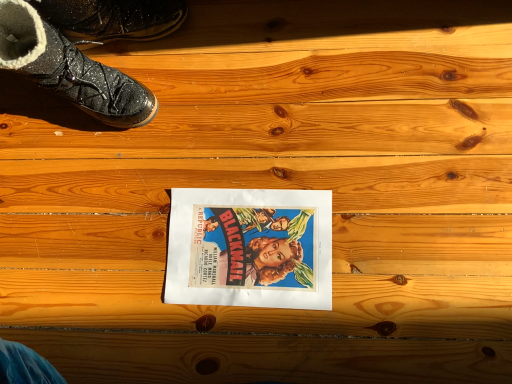
Question: Considering the positions of point (25, 13) and point (131, 14), is point (25, 13) closer or farther from the camera than point (131, 14)?

Choices:
 (A) farther
 (B) closer

Answer: (B)

Question: Is shiny black boot at upper left, which is the 2th footwear from top to bottom, to the left or to the right of sparkly black boot at upper left, placed as the 2th footwear when sorted from bottom to top, in the image?

Choices:
 (A) left
 (B) right

Answer: (A)

Question: Which of these objects is positioned closest to the matte paper movie poster at center?

Choices:
 (A) shiny black boot at upper left, which is the 2th footwear from top to bottom
 (B) sparkly black boot at upper left, which is the 1th footwear from top to bottom

Answer: (A)

Question: Which object is the farthest from the sparkly black boot at upper left, placed as the 2th footwear when sorted from bottom to top?

Choices:
 (A) shiny black boot at upper left, the first footwear in the bottom-to-top sequence
 (B) matte paper movie poster at center

Answer: (B)